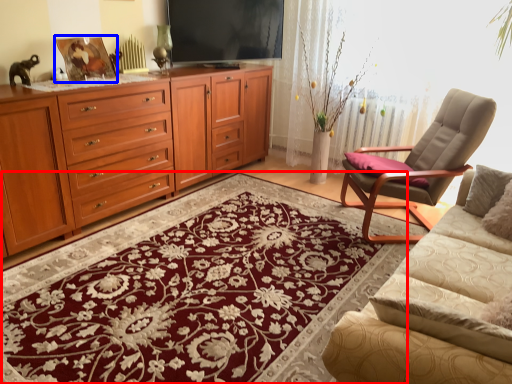
Question: Among these objects, which one is farthest to the camera, mat (highlighted by a red box) or picture frame (highlighted by a blue box)?

Choices:
 (A) mat
 (B) picture frame

Answer: (B)